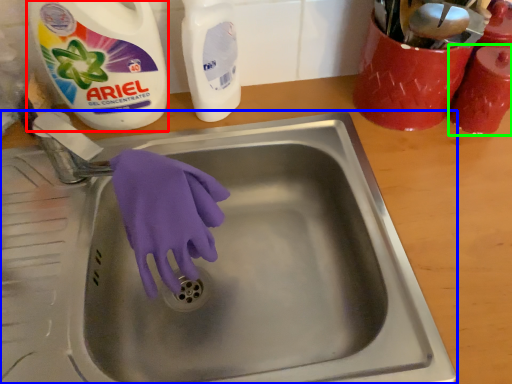
Question: Which object is positioned farthest from cleaning product (highlighted by a red box)? Select from sink (highlighted by a blue box) and cleaning product (highlighted by a green box).

Choices:
 (A) sink
 (B) cleaning product

Answer: (B)